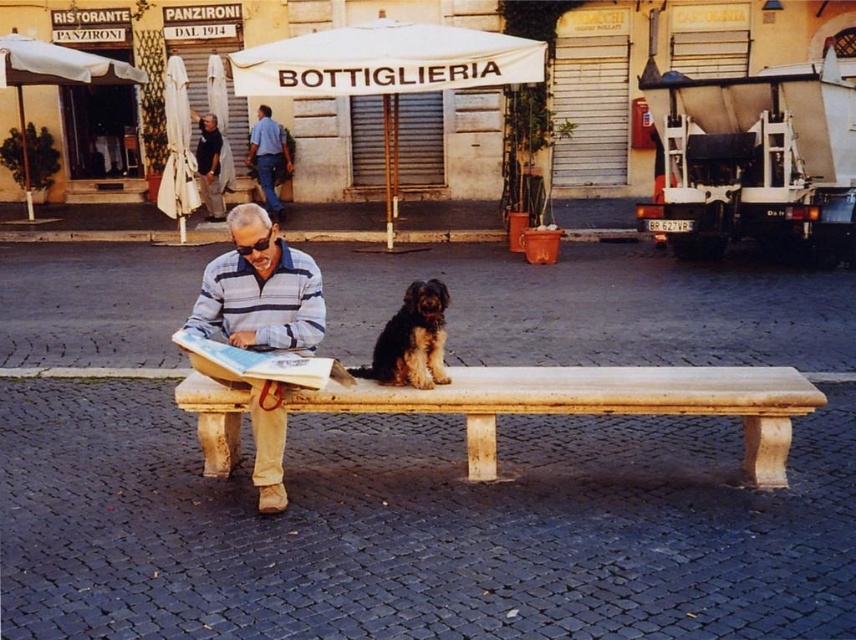
Question: Can you confirm if shaggy brown dog at center is smaller than matte paper book at center?

Choices:
 (A) no
 (B) yes

Answer: (B)

Question: Which object is the closest to the shaggy brown dog at center?

Choices:
 (A) smooth stone bench at center
 (B) dark blue shirt at upper left
 (C) matte paper book at center
 (D) blue jeans at center

Answer: (C)

Question: Which point appears closest to the camera in this image?

Choices:
 (A) 181,339
 (B) 265,273
 (C) 528,384
 (D) 274,164

Answer: (A)

Question: Observing the image, what is the correct spatial positioning of shaggy brown dog at center in reference to blue jeans at center?

Choices:
 (A) left
 (B) right

Answer: (B)

Question: Where is smooth stone bench at center located in relation to blue jeans at center in the image?

Choices:
 (A) left
 (B) right

Answer: (B)

Question: Which object is farther from the camera taking this photo?

Choices:
 (A) dark blue shirt at upper left
 (B) matte paper book at center
 (C) striped cotton shirt at center
 (D) smooth stone bench at center

Answer: (A)